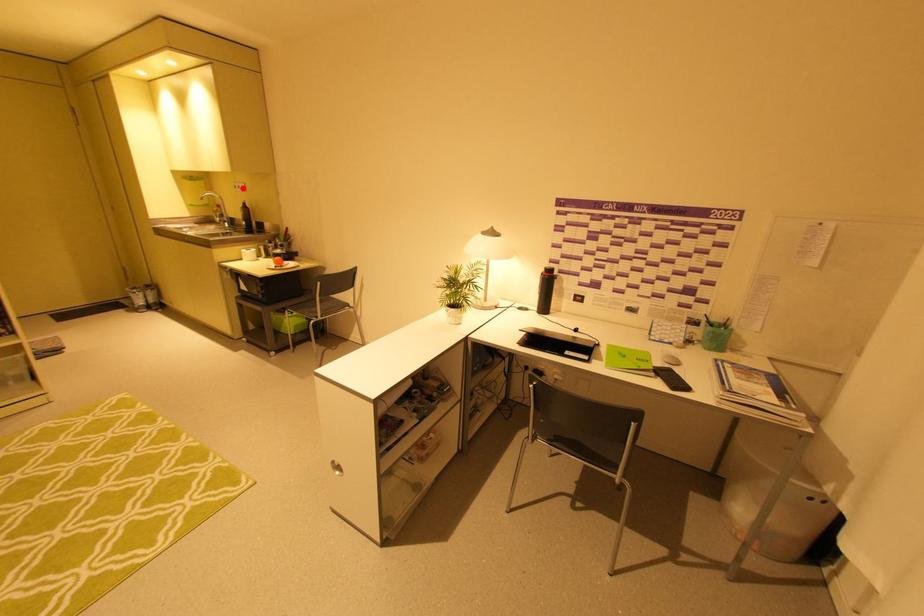
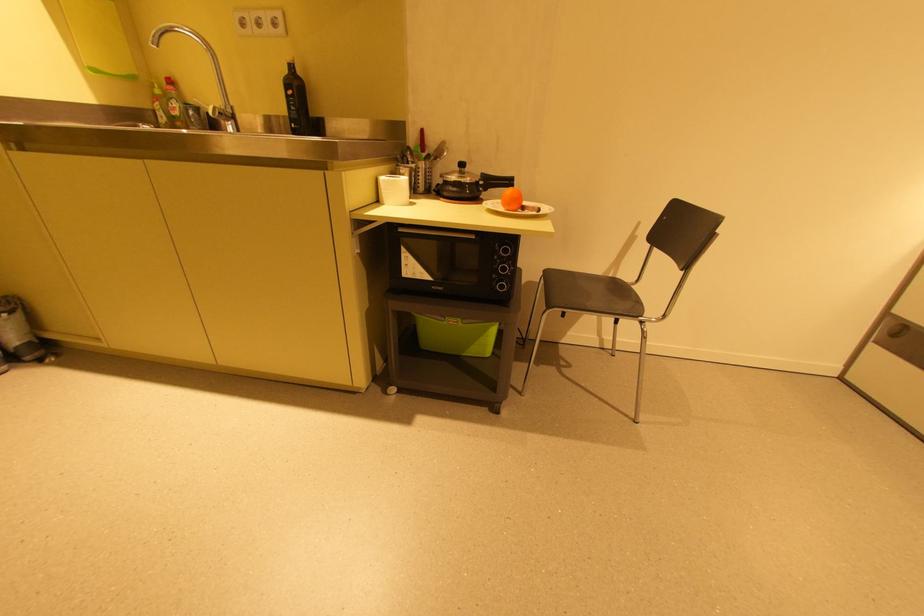
Find the pixel in the second image that matches the highlighted location in the first image.

(263, 23)